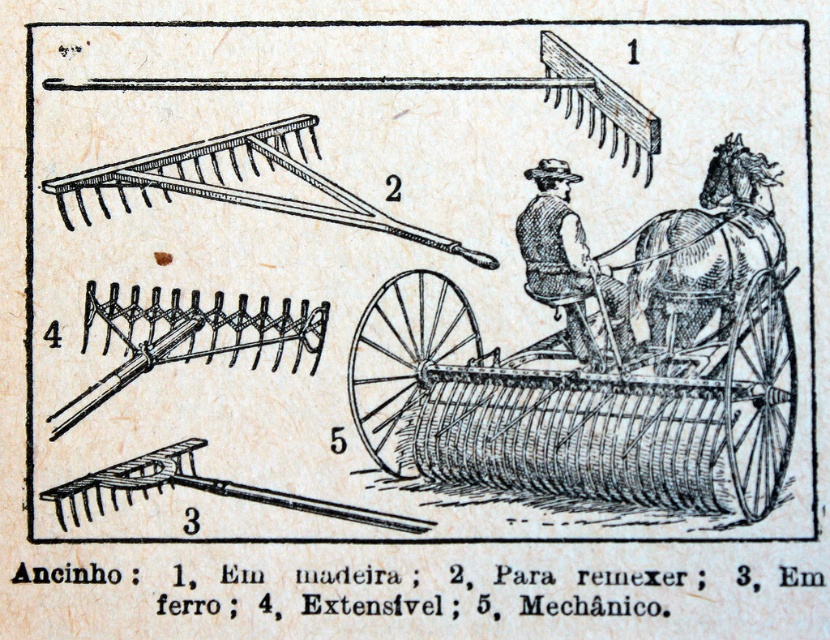
Question: Can you confirm if wooden cart at center is positioned to the right of brown textured horse at upper right?

Choices:
 (A) yes
 (B) no

Answer: (B)

Question: Is wooden cart at center further to camera compared to brown textured horse at upper right?

Choices:
 (A) no
 (B) yes

Answer: (A)

Question: Which point is closer to the camera?

Choices:
 (A) (554, 273)
 (B) (687, 326)
 (C) (664, 259)

Answer: (B)

Question: Which is nearer to the brown textured horse at upper right?

Choices:
 (A) brown leather vest at center
 (B) wooden cart at center

Answer: (B)

Question: Which point is farther to the camera?

Choices:
 (A) (730, 461)
 (B) (530, 244)

Answer: (B)

Question: Can you confirm if brown textured horse at upper right is positioned to the right of brown leather vest at center?

Choices:
 (A) yes
 (B) no

Answer: (A)